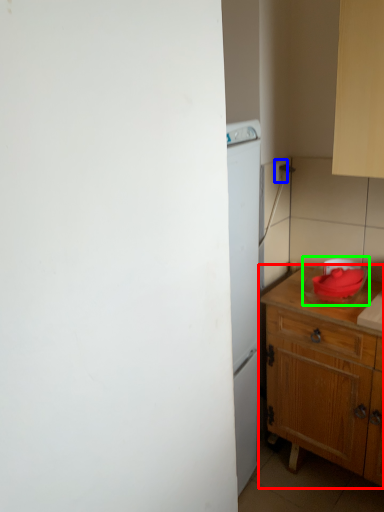
Question: Which object is the closest to the table (highlighted by a red box)? Choose among these: electric outlet (highlighted by a blue box) or appliance (highlighted by a green box).

Choices:
 (A) electric outlet
 (B) appliance

Answer: (B)